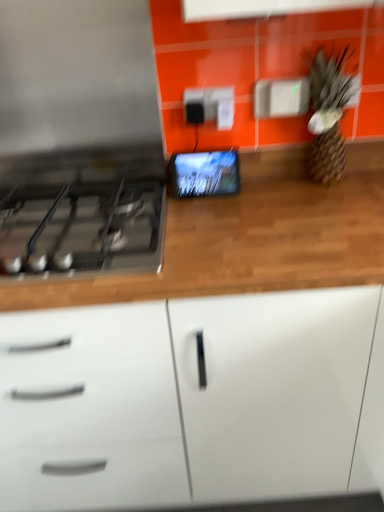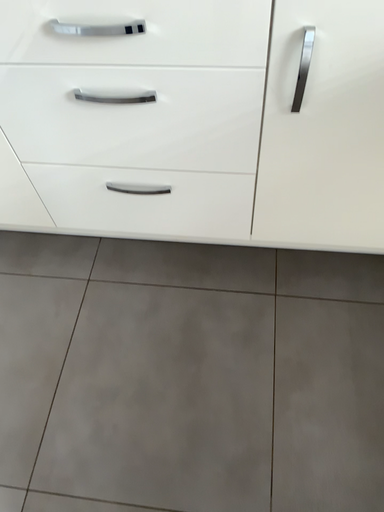
Question: Which way did the camera rotate in the video?

Choices:
 (A) rotated upward
 (B) rotated downward

Answer: (B)